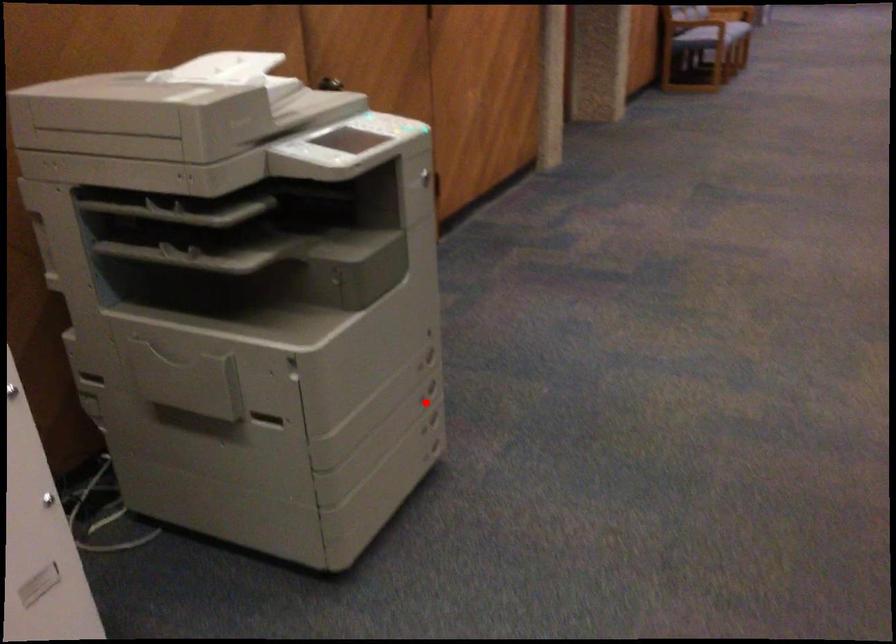
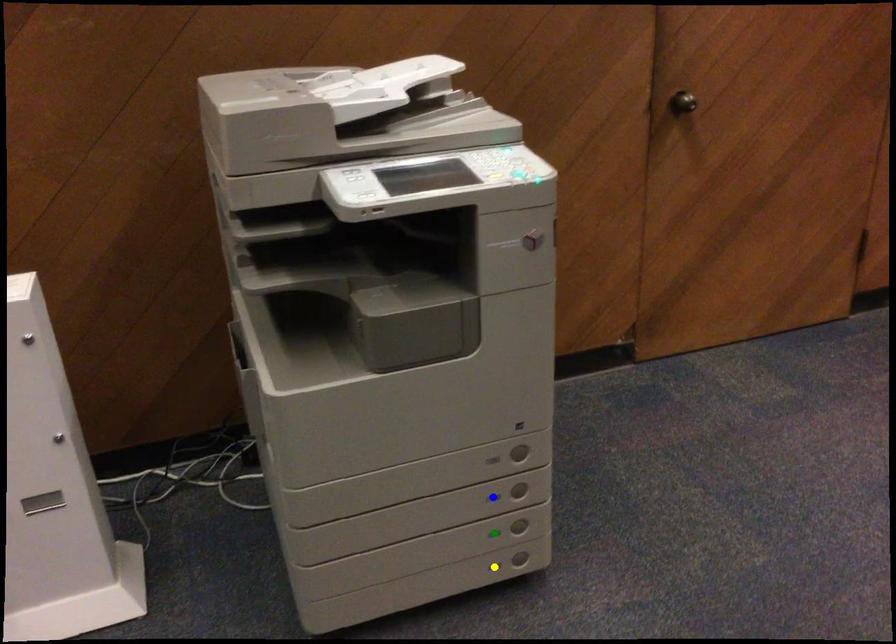
Question: I am providing you with two images of the same scene from different viewpoints. A red point is marked on the first image. You are given multiple points on the second image. Which mark in image 2 goes with the point in image 1?

Choices:
 (A) yellow point
 (B) blue point
 (C) green point

Answer: (B)